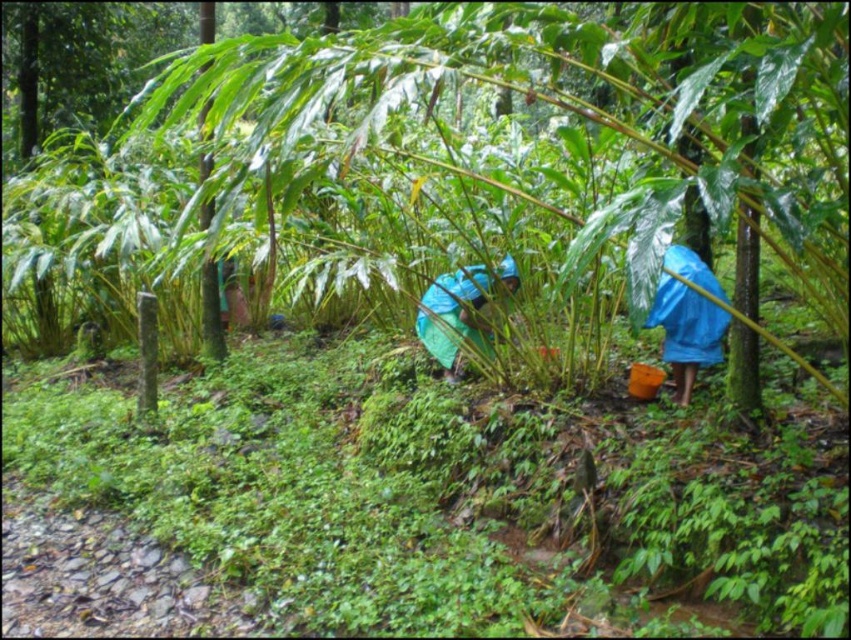
Question: Does blue waterproof jacket at right have a smaller size compared to blue fabric at center?

Choices:
 (A) yes
 (B) no

Answer: (A)

Question: Considering the relative positions of blue waterproof jacket at right and blue fabric at center in the image provided, where is blue waterproof jacket at right located with respect to blue fabric at center?

Choices:
 (A) right
 (B) left

Answer: (A)

Question: Which object appears farthest from the camera in this image?

Choices:
 (A) blue waterproof jacket at right
 (B) blue fabric at center

Answer: (B)

Question: Can you confirm if blue waterproof jacket at right is positioned above blue fabric at center?

Choices:
 (A) yes
 (B) no

Answer: (B)

Question: Which point is farther from the camera taking this photo?

Choices:
 (A) (671, 285)
 (B) (423, 294)

Answer: (B)

Question: Which point is closer to the camera?

Choices:
 (A) (460, 326)
 (B) (664, 339)

Answer: (B)